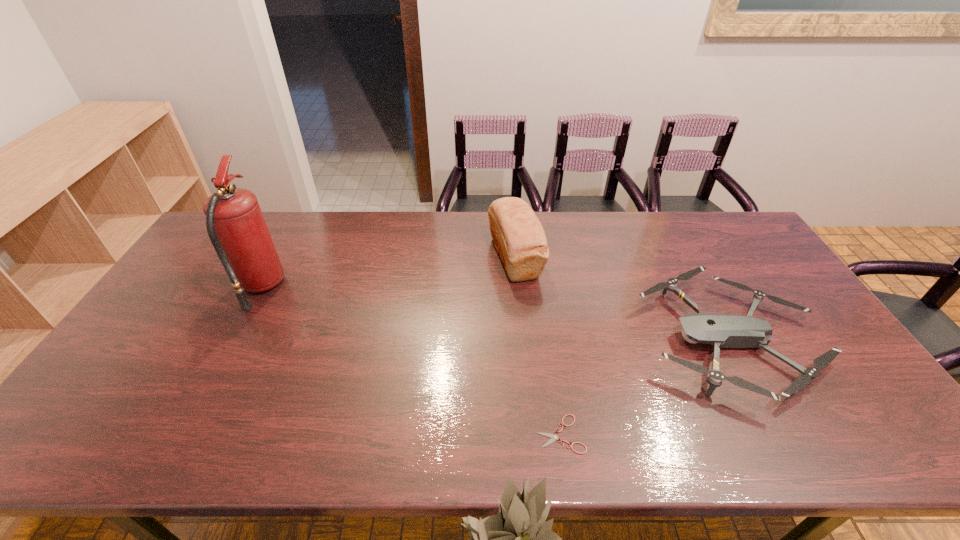
I want to click on the third closest object relative to the rightmost object, so click(x=235, y=224).

Identify the location of free point that satisfies the following two spatial constraints: 1. at the front of the leftmost object where the nozzle is aimed; 2. on the right side of the shortest object. This screenshot has width=960, height=540. (182, 434).

This screenshot has height=540, width=960. I want to click on vacant space that satisfies the following two spatial constraints: 1. at the front of the tallest object where the nozzle is aimed; 2. on the back side of the shortest object, so click(x=182, y=434).

Identify the location of vacant space that satisfies the following two spatial constraints: 1. at the front of the shears where the nozzle is aimed; 2. on the right side of the leftmost object. point(182,434).

You are a GUI agent. You are given a task and a screenshot of the screen. Output one action in this format:
    pyautogui.click(x=<x>, y=<y>)
    Task: Click on the vacant area that satisfies the following two spatial constraints: 1. on the back side of the shears; 2. at the front of the leftmost object where the nozzle is aimed
    Image resolution: width=960 pixels, height=540 pixels.
    Given the screenshot: What is the action you would take?
    pyautogui.click(x=540, y=287)